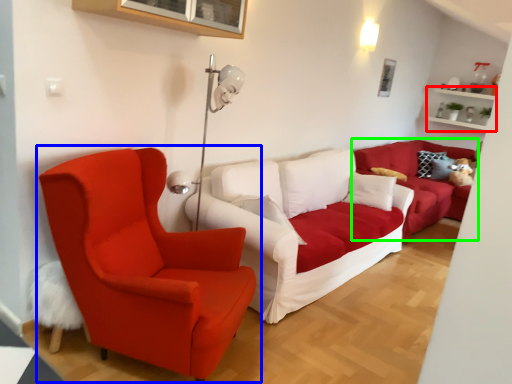
Question: Which object is positioned farthest from shelf (highlighted by a red box)? Select from chair (highlighted by a blue box) and studio couch (highlighted by a green box).

Choices:
 (A) chair
 (B) studio couch

Answer: (A)